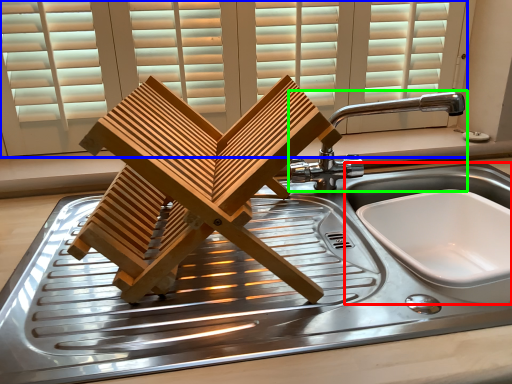
Question: Which object is positioned farthest from sink (highlighted by a red box)? Select from window (highlighted by a blue box) and tap (highlighted by a green box).

Choices:
 (A) window
 (B) tap

Answer: (A)